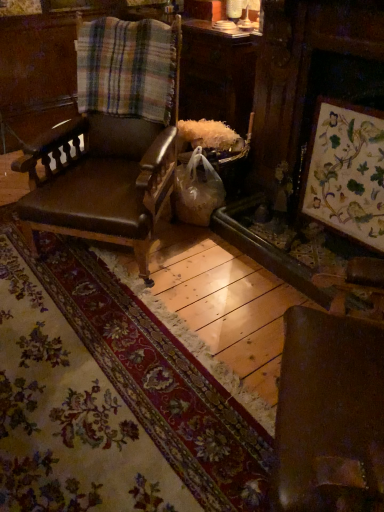
Question: Considering the positions of plaid fabric at upper left and brown leather chair at center in the image, is plaid fabric at upper left wider or thinner than brown leather chair at center?

Choices:
 (A) thin
 (B) wide

Answer: (A)

Question: From their relative heights in the image, would you say plaid fabric at upper left is taller or shorter than brown leather chair at center?

Choices:
 (A) short
 (B) tall

Answer: (A)

Question: Estimate the real-world distances between objects in this image. Which object is closer to the brown leather chair at center?

Choices:
 (A) wooden floral artwork at right
 (B) plaid fabric at upper left

Answer: (B)

Question: Which is farther from the wooden floral artwork at right?

Choices:
 (A) plaid fabric at upper left
 (B) brown leather chair at center

Answer: (A)